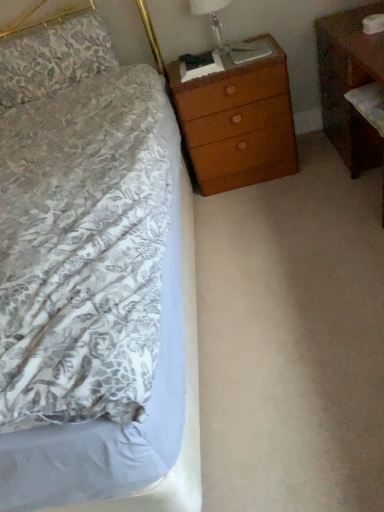
Question: From the image's perspective, is brown wood nightstand at right located above or below translucent glass lampshade at upper right?

Choices:
 (A) above
 (B) below

Answer: (B)

Question: In terms of size, does brown wood nightstand at right appear bigger or smaller than translucent glass lampshade at upper right?

Choices:
 (A) small
 (B) big

Answer: (B)

Question: Considering the real-world distances, which object is farthest from the floral fabric pillow at upper left?

Choices:
 (A) wooden chest of drawers at upper right
 (B) translucent glass lampshade at upper right
 (C) brown wood nightstand at right

Answer: (C)

Question: Estimate the real-world distances between objects in this image. Which object is farther from the translucent glass lampshade at upper right?

Choices:
 (A) brown wood nightstand at right
 (B) wooden chest of drawers at upper right
 (C) floral fabric pillow at upper left

Answer: (C)